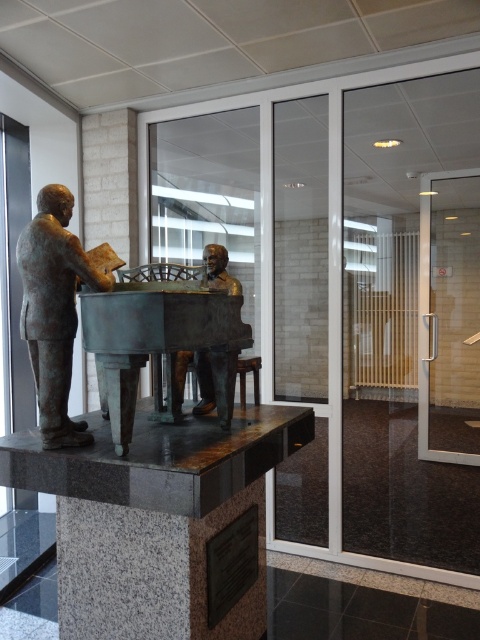
Does bronze polished piano at center appear on the left side of bronze bust at center?

Indeed, bronze polished piano at center is positioned on the left side of bronze bust at center.

Can you confirm if bronze polished piano at center is positioned to the right of bronze bust at center?

Incorrect, bronze polished piano at center is not on the right side of bronze bust at center.

Measure the distance between point (94, 340) and camera.

Point (94, 340) and camera are 6.18 feet apart.

Identify the location of bronze polished piano at center. This screenshot has width=480, height=640. (159, 344).

Between bronze statue at left and bronze bust at center, which one has less height?

bronze bust at center

Is bronze statue at left to the left of bronze bust at center from the viewer's perspective?

Yes, bronze statue at left is to the left of bronze bust at center.

The image size is (480, 640). Identify the location of bronze statue at left. (54, 308).

Who is higher up, bronze polished piano at center or bronze statue at left?

bronze statue at left is above.

Does bronze polished piano at center lie in front of bronze statue at left?

That is True.

This screenshot has width=480, height=640. Find the location of `bronze polished piano at center`. bronze polished piano at center is located at coordinates (159, 344).